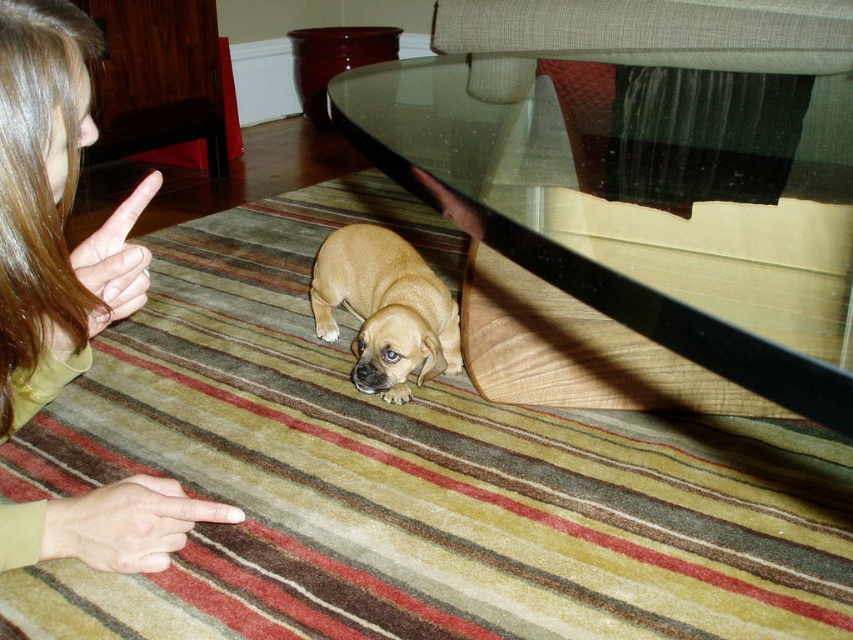
You are a photographer standing at the camera position. You want to take a closeup shot of the point marked as point (643, 234). Is this point within your reach if you can only move forward up to 60 centimeters from your current position?

The point (643, 234) is 65.20 centimeters away from the camera. Since you can only move forward up to 60 centimeters, you cannot reach the point within the allowed distance.

You are a robot trying to identify the hand positions in the scene. Which object is smaller between the smooth beige hand at lower left and the light brown skin at upper left?

The smooth beige hand at lower left is smaller than the light brown skin at upper left.

You are a photographer trying to capture the interaction between the smooth beige hand at lower left and the light brown skin at upper left. Which object would you need to adjust if you want to frame the wider one first in your shot?

The smooth beige hand at lower left is wider than the light brown skin at upper left, so you should adjust the framing to include the smooth beige hand at lower left first since it is wider.